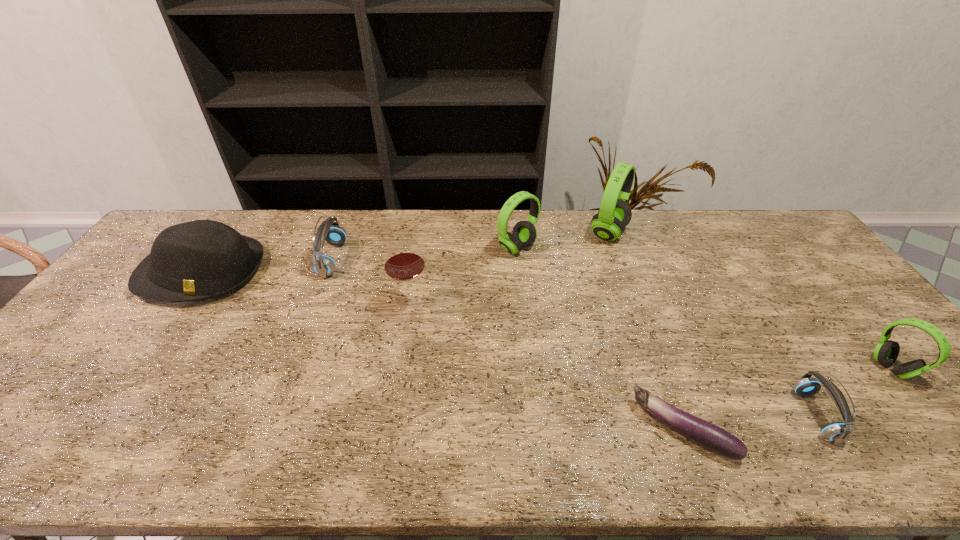
Identify the location of green headset that stands as the third closest to the farther blue headset. (886, 352).

Identify which green headset is located as the nearest to the rightmost headset. Please provide its 2D coordinates. Your answer should be formatted as a tuple, i.e. [(x, y)], where the tuple contains the x and y coordinates of a point satisfying the conditions above.

[(614, 214)]

The height and width of the screenshot is (540, 960). In order to click on vacant space that satisfies the following two spatial constraints: 1. on the back side of the fourth shortest headset; 2. on the left side of the wineglass in this screenshot , I will do `click(420, 248)`.

Find the location of `vacant point that satisfies the following two spatial constraints: 1. on the back side of the fifth object from right to left; 2. on the left side of the red wineglass`. vacant point that satisfies the following two spatial constraints: 1. on the back side of the fifth object from right to left; 2. on the left side of the red wineglass is located at coordinates (420, 248).

The width and height of the screenshot is (960, 540). Find the location of `vacant space that satisfies the following two spatial constraints: 1. on the front-facing side of the gray fedora; 2. on the right side of the purple eggplant`. vacant space that satisfies the following two spatial constraints: 1. on the front-facing side of the gray fedora; 2. on the right side of the purple eggplant is located at coordinates (92, 430).

Image resolution: width=960 pixels, height=540 pixels. Find the location of `vacant space that satisfies the following two spatial constraints: 1. on the front side of the leftmost green headset; 2. on the ear cups of the leftmost headset`. vacant space that satisfies the following two spatial constraints: 1. on the front side of the leftmost green headset; 2. on the ear cups of the leftmost headset is located at coordinates (518, 259).

Locate an element on the screen. vacant region that satisfies the following two spatial constraints: 1. on the ear cups of the wineglass; 2. on the left side of the leftmost headset is located at coordinates (315, 306).

Image resolution: width=960 pixels, height=540 pixels. I want to click on vacant space that satisfies the following two spatial constraints: 1. on the front-facing side of the rightmost object; 2. on the right side of the leftmost object, so click(x=135, y=368).